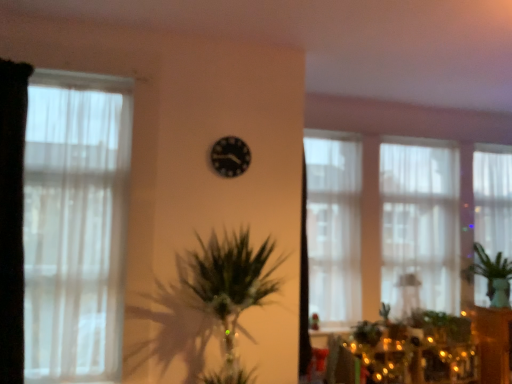
Question: Can you confirm if green leafy plant at right is positioned to the right of black matte clock at center?

Choices:
 (A) no
 (B) yes

Answer: (B)

Question: Is green leafy plant at right shorter than black matte clock at center?

Choices:
 (A) no
 (B) yes

Answer: (A)

Question: Does green leafy plant at right have a larger size compared to black matte clock at center?

Choices:
 (A) yes
 (B) no

Answer: (A)

Question: Could you tell me if green leafy plant at right is facing black matte clock at center?

Choices:
 (A) no
 (B) yes

Answer: (A)

Question: Is green leafy plant at right far away from black matte clock at center?

Choices:
 (A) yes
 (B) no

Answer: (A)

Question: Is green leafy plant at right inside the boundaries of wooden cabinet at right, or outside?

Choices:
 (A) inside
 (B) outside

Answer: (B)

Question: From a real-world perspective, is green leafy plant at right physically located above or below wooden cabinet at right?

Choices:
 (A) below
 (B) above

Answer: (B)

Question: Relative to wooden cabinet at right, is green leafy plant at right in front or behind?

Choices:
 (A) behind
 (B) front

Answer: (B)

Question: From the image's perspective, is green leafy plant at right positioned above or below wooden cabinet at right?

Choices:
 (A) below
 (B) above

Answer: (B)

Question: From a real-world perspective, relative to green leafy plant at right, is translucent fabric window at center, the 2th window when ordered from front to back, vertically above or below?

Choices:
 (A) above
 (B) below

Answer: (A)

Question: Based on their sizes in the image, would you say translucent fabric window at center, the 3th window in the right-to-left sequence, is bigger or smaller than green leafy plant at right?

Choices:
 (A) small
 (B) big

Answer: (A)

Question: Does point (317, 177) appear closer or farther from the camera than point (475, 271)?

Choices:
 (A) closer
 (B) farther

Answer: (A)

Question: In terms of width, does translucent fabric window at center, marked as the second window in a left-to-right arrangement, look wider or thinner when compared to green leafy plant at right?

Choices:
 (A) wide
 (B) thin

Answer: (B)

Question: Is wooden cabinet at right in front of or behind translucent fabric window at center, the 2th window when ordered from back to front, in the image?

Choices:
 (A) front
 (B) behind

Answer: (A)

Question: Does point (501, 327) appear closer or farther from the camera than point (438, 286)?

Choices:
 (A) closer
 (B) farther

Answer: (A)